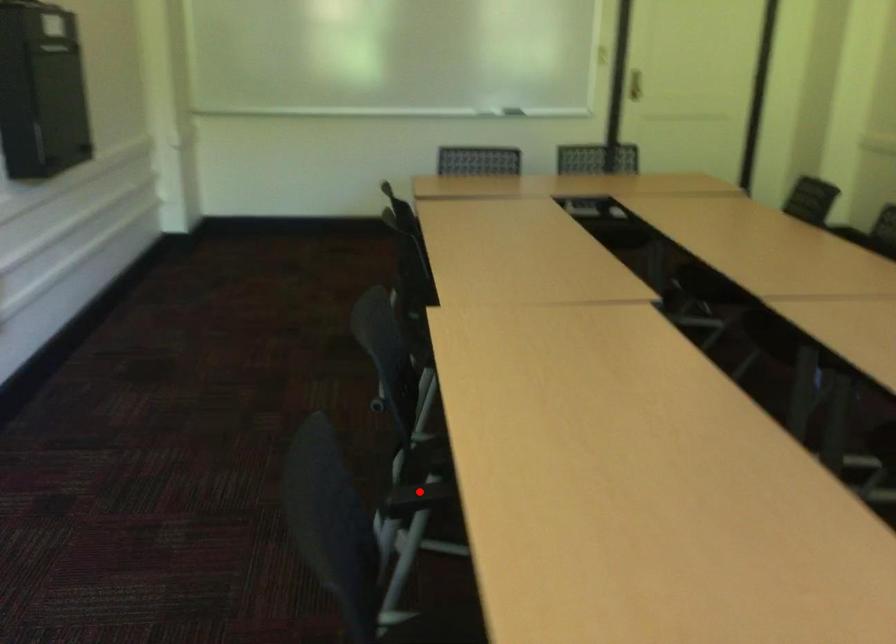
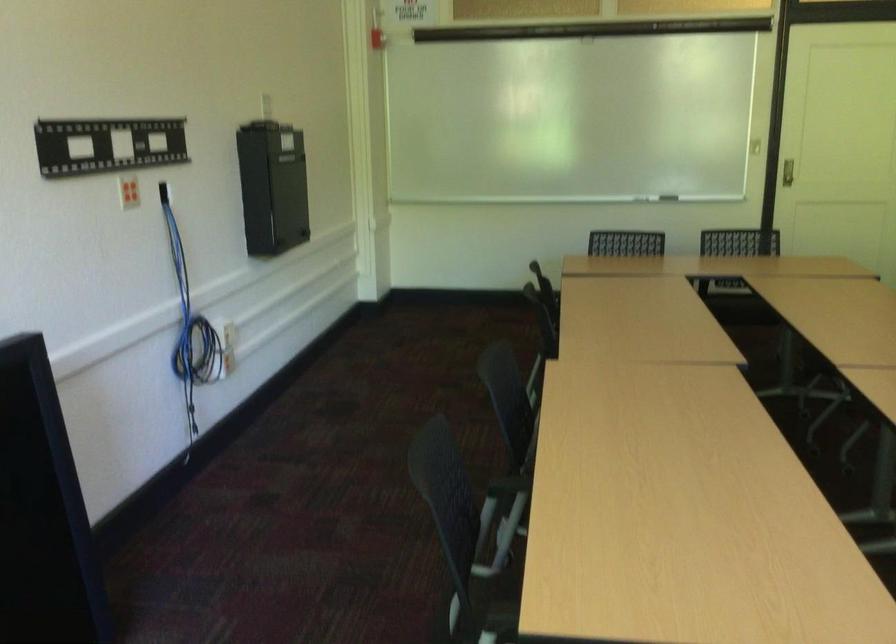
Question: A red point is marked in image1. In image2, is the corresponding 3D point closer to the camera or farther? Reply with the corresponding letter.

Choices:
 (A) The corresponding 3D point is closer.
 (B) The corresponding 3D point is farther.

Answer: (B)